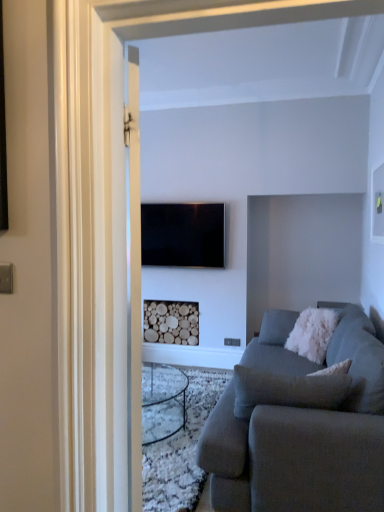
Describe the element at coordinates (171, 322) in the screenshot. The height and width of the screenshot is (512, 384). I see `wooden logs at center` at that location.

Measure the distance between gray fabric couch at lower right and camera.

6.41 feet.

Find the location of a particular element. white fluffy pillow at right is located at coordinates (312, 333).

Consider the image. What's the angular difference between gray fabric couch at lower right and wooden logs at center's facing directions?

91.4 degrees.

Which is in front, point (219, 498) or point (183, 309)?

The point (219, 498) is closer to the camera.

From a real-world perspective, is gray fabric couch at lower right positioned under wooden logs at center based on gravity?

Yes, from a real-world perspective, gray fabric couch at lower right is beneath wooden logs at center.

Measure the distance from gray fabric couch at lower right to wooden logs at center.

gray fabric couch at lower right is 2.36 meters from wooden logs at center.

Considering the sizes of objects flat screen tv at center and gray fabric couch at lower right in the image provided, who is shorter, flat screen tv at center or gray fabric couch at lower right?

flat screen tv at center is shorter.

Which of these two, flat screen tv at center or gray fabric couch at lower right, is smaller?

With smaller size is flat screen tv at center.

Considering the points (179, 264) and (226, 485), which point is in front, point (179, 264) or point (226, 485)?

The point (226, 485) is more forward.

Can you tell me how much white fluffy pillow at right and flat screen tv at center differ in facing direction?

The angular difference between white fluffy pillow at right and flat screen tv at center is 51.3 degrees.

From the image's perspective, who appears lower, white fluffy pillow at right or flat screen tv at center?

From the image's view, white fluffy pillow at right is below.

The image size is (384, 512). I want to click on television lying above the white fluffy pillow at right (from the image's perspective), so click(x=183, y=234).

Does white fluffy pillow at right come in front of flat screen tv at center?

Yes, it is in front of flat screen tv at center.

Visually, is white fluffy pillow at right positioned to the left or to the right of wooden logs at center?

Based on their positions, white fluffy pillow at right is located to the right of wooden logs at center.

Considering the sizes of objects white fluffy pillow at right and wooden logs at center in the image provided, who is shorter, white fluffy pillow at right or wooden logs at center?

wooden logs at center is shorter.

Who is bigger, white fluffy pillow at right or wooden logs at center?

With larger size is white fluffy pillow at right.

What are the coordinates of `fireplace below the white fluffy pillow at right (from a real-world perspective)` in the screenshot? It's located at (171, 322).

In order to click on studio couch below the flat screen tv at center (from a real-world perspective) in this screenshot , I will do `click(300, 425)`.

Considering the relative positions of gray fabric couch at lower right and flat screen tv at center in the image provided, is gray fabric couch at lower right to the left of flat screen tv at center from the viewer's perspective?

No.

Which of these two, gray fabric couch at lower right or flat screen tv at center, is bigger?

gray fabric couch at lower right.

The height and width of the screenshot is (512, 384). Find the location of `fireplace behind the white fluffy pillow at right`. fireplace behind the white fluffy pillow at right is located at coordinates (171, 322).

Is wooden logs at center bigger or smaller than white fluffy pillow at right?

wooden logs at center is smaller than white fluffy pillow at right.

From a real-world perspective, is wooden logs at center positioned over white fluffy pillow at right based on gravity?

A: No, from a real-world perspective, wooden logs at center is not on top of white fluffy pillow at right.

Is wooden logs at center positioned with its back to white fluffy pillow at right?

wooden logs at center does not have its back to white fluffy pillow at right.

Is flat screen tv at center taller than wooden logs at center?

Indeed, flat screen tv at center has a greater height compared to wooden logs at center.

Which is further, (185, 212) or (160, 318)?

The point (160, 318) is farther from the camera.

Are flat screen tv at center and wooden logs at center beside each other?

No, flat screen tv at center is not making contact with wooden logs at center.

Is wooden logs at center located within flat screen tv at center?

No, wooden logs at center is not surrounded by flat screen tv at center.

The image size is (384, 512). Find the location of `studio couch on the right side of wooden logs at center`. studio couch on the right side of wooden logs at center is located at coordinates (300, 425).

The width and height of the screenshot is (384, 512). I want to click on studio couch below the flat screen tv at center (from a real-world perspective), so click(300, 425).

Estimate the real-world distances between objects in this image. Which object is further from gray fabric couch at lower right, flat screen tv at center or white fluffy pillow at right?

Among the two, flat screen tv at center is located further to gray fabric couch at lower right.

From the image, which object appears to be nearer to gray fabric couch at lower right, wooden logs at center or white fluffy pillow at right?

white fluffy pillow at right lies closer to gray fabric couch at lower right than the other object.

Looking at the image, which one is located closer to gray fabric couch at lower right, white fluffy pillow at right or flat screen tv at center?

white fluffy pillow at right lies closer to gray fabric couch at lower right than the other object.

Based on their spatial positions, is white fluffy pillow at right or gray fabric couch at lower right further from flat screen tv at center?

Among the two, gray fabric couch at lower right is located further to flat screen tv at center.

Considering their positions, is wooden logs at center positioned further to white fluffy pillow at right than flat screen tv at center?

Among the two, flat screen tv at center is located further to white fluffy pillow at right.

Which object lies nearer to the anchor point white fluffy pillow at right, flat screen tv at center or wooden logs at center?

wooden logs at center lies closer to white fluffy pillow at right than the other object.

Considering their positions, is flat screen tv at center positioned further to wooden logs at center than gray fabric couch at lower right?

gray fabric couch at lower right is further to wooden logs at center.

Based on the photo, when comparing their distances from flat screen tv at center, does gray fabric couch at lower right or wooden logs at center seem closer?

wooden logs at center is closer to flat screen tv at center.

Identify the location of pillow located between gray fabric couch at lower right and flat screen tv at center in the depth direction. (312, 333).

The image size is (384, 512). Identify the location of pillow between gray fabric couch at lower right and wooden logs at center from front to back. (312, 333).

Identify the location of television positioned between gray fabric couch at lower right and wooden logs at center from near to far. This screenshot has width=384, height=512. (183, 234).

Identify the location of television between wooden logs at center and white fluffy pillow at right. (183, 234).